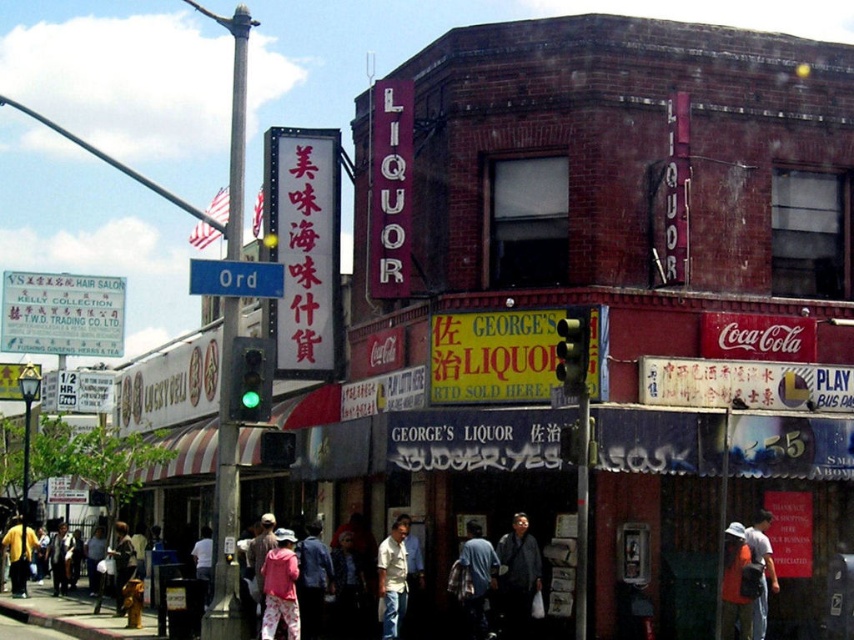
You are a customer standing in front of the store and see the dark blue shirt at center and the denim jacket at center. Which clothing item is positioned higher on the display?

The dark blue shirt at center is located above the denim jacket at center, so it is positioned higher on the display.

You are a customer standing in front of the red brick building with a Liquor sign. You see a denim jacket at center and a yellow matte jacket at lower left. Which jacket is nearer to you?

The denim jacket at center is closer to the viewer than the yellow matte jacket at lower left.

You are a delivery person standing at the yellow matte jacket at lower left, and you need to deliver a package to the denim jacket at center. Given that your delivery robot has a maximum range of 20 meters, will it be able to reach the destination without recharging?

The distance between the yellow matte jacket at lower left and the denim jacket at center is 21.22 meters, which exceeds the robot delivery range of 20 meters. The robot cannot reach the destination without recharging.